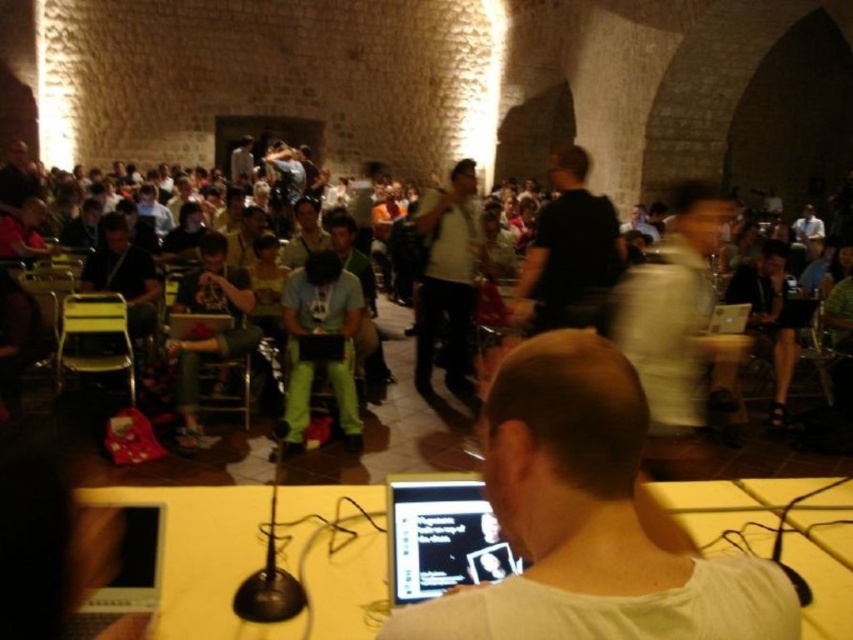
Can you confirm if light brown leather jacket at center is positioned below black glossy laptop at lower center?

Incorrect, light brown leather jacket at center is not positioned below black glossy laptop at lower center.

Which of these two, light brown leather jacket at center or black glossy laptop at lower center, stands shorter?

black glossy laptop at lower center

Where is `light brown leather jacket at center`? Image resolution: width=853 pixels, height=640 pixels. light brown leather jacket at center is located at coordinates (672, 310).

What are the coordinates of `light brown leather jacket at center` in the screenshot? It's located at (672, 310).

Can you confirm if white matte shirt at center is taller than black glossy laptop at lower center?

Yes.

Who is more distant from viewer, [527,616] or [419,554]?

Point [419,554]

You are a GUI agent. You are given a task and a screenshot of the screen. Output one action in this format:
    pyautogui.click(x=<x>, y=<y>)
    Task: Click on the white matte shirt at center
    The image size is (853, 640).
    Given the screenshot: What is the action you would take?
    pyautogui.click(x=589, y=520)

Is white matte shirt at center to the left of light brown leather jacket at center from the viewer's perspective?

Correct, you'll find white matte shirt at center to the left of light brown leather jacket at center.

Is point (570, 476) closer to camera compared to point (659, 413)?

Yes, point (570, 476) is closer to viewer.

Which is behind, point (662, 588) or point (691, 259)?

The point (691, 259) is more distant.

Where is `white matte shirt at center`? This screenshot has height=640, width=853. white matte shirt at center is located at coordinates (589, 520).